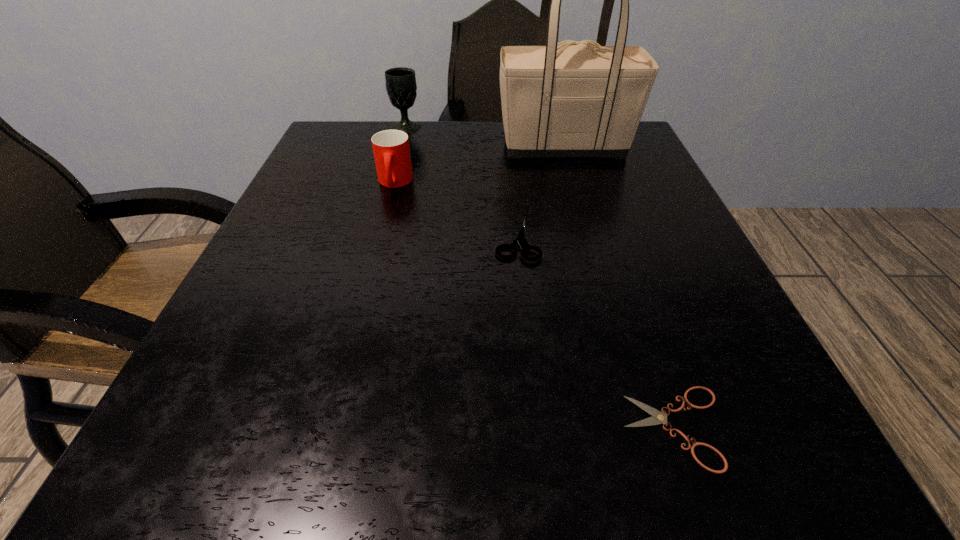
Find the location of a particular element. This screenshot has width=960, height=540. cup present at the left edge is located at coordinates (391, 149).

Where is `shopping bag that is at the right edge`? Image resolution: width=960 pixels, height=540 pixels. shopping bag that is at the right edge is located at coordinates (579, 99).

Where is `shears located in the right edge section of the desktop`? The image size is (960, 540). shears located in the right edge section of the desktop is located at coordinates (658, 417).

The height and width of the screenshot is (540, 960). Identify the location of chalice that is positioned at the far left corner. coord(401,87).

Locate an element on the screen. cup located in the far left corner section of the desktop is located at coordinates (391, 149).

The height and width of the screenshot is (540, 960). I want to click on object positioned at the far right corner, so click(579, 99).

At what (x,y) coordinates should I click in order to perform the action: click on object that is at the near right corner. Please return your answer as a coordinate pair (x, y). The height and width of the screenshot is (540, 960). Looking at the image, I should click on (658, 417).

Locate an element on the screen. This screenshot has width=960, height=540. free space at the far edge of the desktop is located at coordinates (429, 145).

This screenshot has height=540, width=960. What are the coordinates of `free spot at the near edge of the desktop` in the screenshot? It's located at (642, 488).

The height and width of the screenshot is (540, 960). In the image, there is a desktop. Identify the location of free space at the left edge. (278, 248).